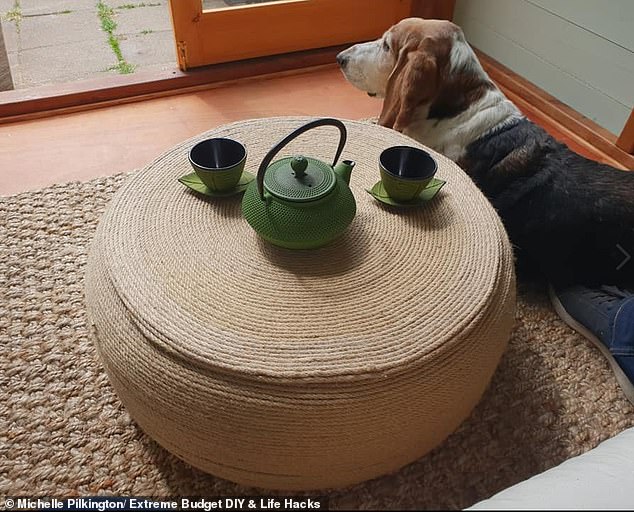
Where is `teapot`? This screenshot has height=512, width=634. teapot is located at coordinates (302, 219).